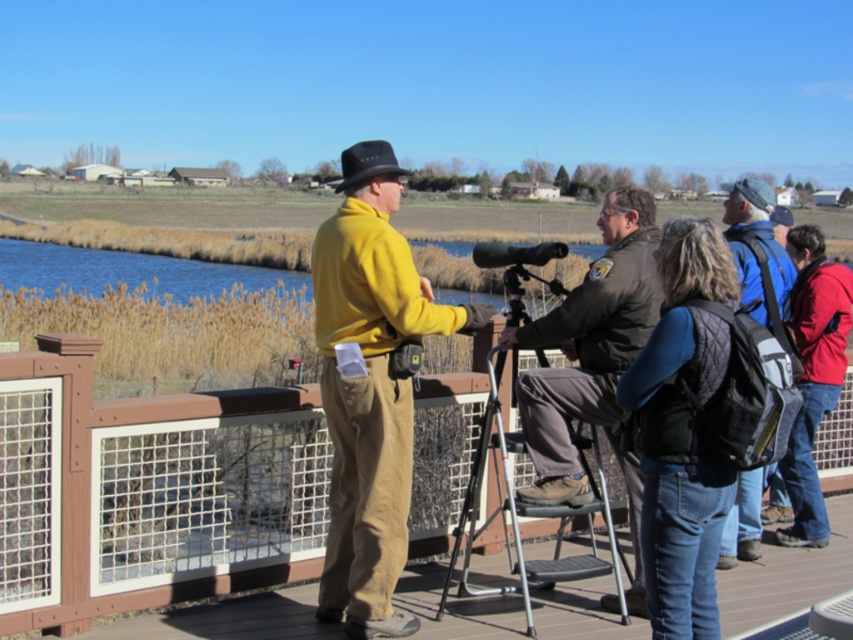
Question: Can you confirm if brown wood deck at lower center is positioned to the left of red jacket at right?

Choices:
 (A) no
 (B) yes

Answer: (B)

Question: Is wooden fence at lower left above metallic tripod at center?

Choices:
 (A) no
 (B) yes

Answer: (A)

Question: Which of these objects is positioned farthest from the khaki pants at center?

Choices:
 (A) metallic tripod at center
 (B) wooden fence at lower left
 (C) red jacket at right

Answer: (C)

Question: Which of the following is the farthest from the observer?

Choices:
 (A) khaki pants at center
 (B) red jacket at right
 (C) brown wood deck at lower center
 (D) blue quilted backpack at right

Answer: (B)

Question: Is wooden fence at lower left to the right of brown wood deck at lower center from the viewer's perspective?

Choices:
 (A) no
 (B) yes

Answer: (A)

Question: Estimate the real-world distances between objects in this image. Which object is closer to the red jacket at right?

Choices:
 (A) wooden fence at lower left
 (B) khaki pants at center

Answer: (B)